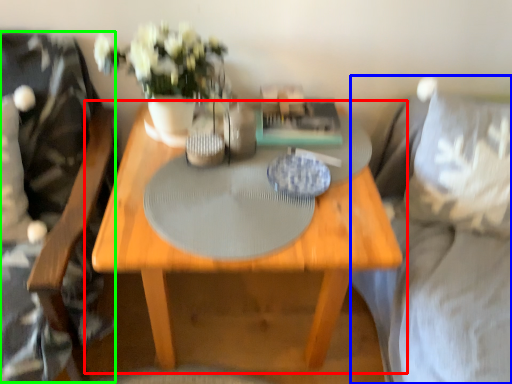
Question: Estimate the real-world distances between objects in this image. Which object is farther from table (highlighted by a red box), couch (highlighted by a blue box) or swivel chair (highlighted by a green box)?

Choices:
 (A) couch
 (B) swivel chair

Answer: (A)